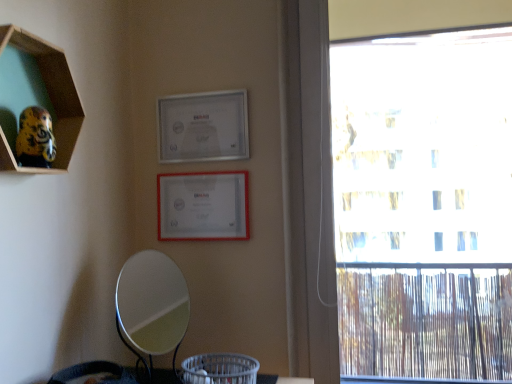
Question: From the image's perspective, does white matte picture frame at upper center, marked as the 2th picture frame in a top-to-bottom arrangement, appear lower than silver/metallic mirror at lower center?

Choices:
 (A) yes
 (B) no

Answer: (B)

Question: Can you confirm if white matte picture frame at upper center, marked as the 2th picture frame in a top-to-bottom arrangement, is bigger than silver/metallic mirror at lower center?

Choices:
 (A) no
 (B) yes

Answer: (A)

Question: Is white matte picture frame at upper center, marked as the 2th picture frame in a top-to-bottom arrangement, taller than silver/metallic mirror at lower center?

Choices:
 (A) yes
 (B) no

Answer: (B)

Question: Can we say white matte picture frame at upper center, marked as the 2th picture frame in a top-to-bottom arrangement, lies outside silver/metallic mirror at lower center?

Choices:
 (A) yes
 (B) no

Answer: (A)

Question: Does white matte picture frame at upper center, which is counted as the first picture frame, starting from the bottom, appear on the right side of silver/metallic mirror at lower center?

Choices:
 (A) yes
 (B) no

Answer: (A)

Question: Considering the relative sizes of white matte picture frame at upper center, which is counted as the first picture frame, starting from the bottom, and silver/metallic mirror at lower center in the image provided, is white matte picture frame at upper center, which is counted as the first picture frame, starting from the bottom, shorter than silver/metallic mirror at lower center?

Choices:
 (A) yes
 (B) no

Answer: (A)

Question: Does silver/metallic mirror at lower center come in front of wooden hexagon at upper left?

Choices:
 (A) no
 (B) yes

Answer: (A)

Question: Is silver/metallic mirror at lower center far from wooden hexagon at upper left?

Choices:
 (A) no
 (B) yes

Answer: (A)

Question: From a real-world perspective, is silver/metallic mirror at lower center positioned over wooden hexagon at upper left based on gravity?

Choices:
 (A) no
 (B) yes

Answer: (A)

Question: Is silver/metallic mirror at lower center looking in the opposite direction of wooden hexagon at upper left?

Choices:
 (A) yes
 (B) no

Answer: (B)

Question: Can you confirm if silver/metallic mirror at lower center is positioned to the left of wooden hexagon at upper left?

Choices:
 (A) no
 (B) yes

Answer: (A)

Question: Is silver/metallic mirror at lower center oriented towards wooden hexagon at upper left?

Choices:
 (A) no
 (B) yes

Answer: (A)

Question: From a real-world perspective, does silver metallic picture frame at upper center, which is the first picture frame from top to bottom, sit lower than silver/metallic mirror at lower center?

Choices:
 (A) no
 (B) yes

Answer: (A)